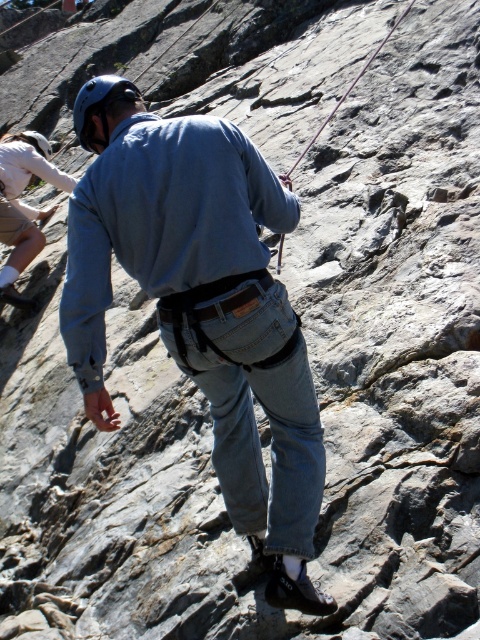
Does point (183, 332) lie behind point (131, 100)?

No, (183, 332) is closer to viewer.

Can you confirm if denim jeans at center is positioned to the left of matte blue helmet at upper left?

In fact, denim jeans at center is to the right of matte blue helmet at upper left.

Where is `denim jeans at center`? denim jeans at center is located at coordinates (205, 314).

Can you confirm if denim jeans at center is positioned to the right of white cotton shirt at upper left?

Correct, you'll find denim jeans at center to the right of white cotton shirt at upper left.

Does point (120, 221) come behind point (15, 220)?

That is False.

Measure the distance between denim jeans at center and camera.

denim jeans at center is 5.13 meters from camera.

The width and height of the screenshot is (480, 640). Find the location of `denim jeans at center`. denim jeans at center is located at coordinates (205, 314).

Can you confirm if white cotton shirt at upper left is wider than matte blue helmet at upper left?

In fact, white cotton shirt at upper left might be narrower than matte blue helmet at upper left.

Which is in front, point (15, 200) or point (108, 93)?

Positioned in front is point (108, 93).

This screenshot has height=640, width=480. In order to click on white cotton shirt at upper left in this screenshot , I will do `click(23, 205)`.